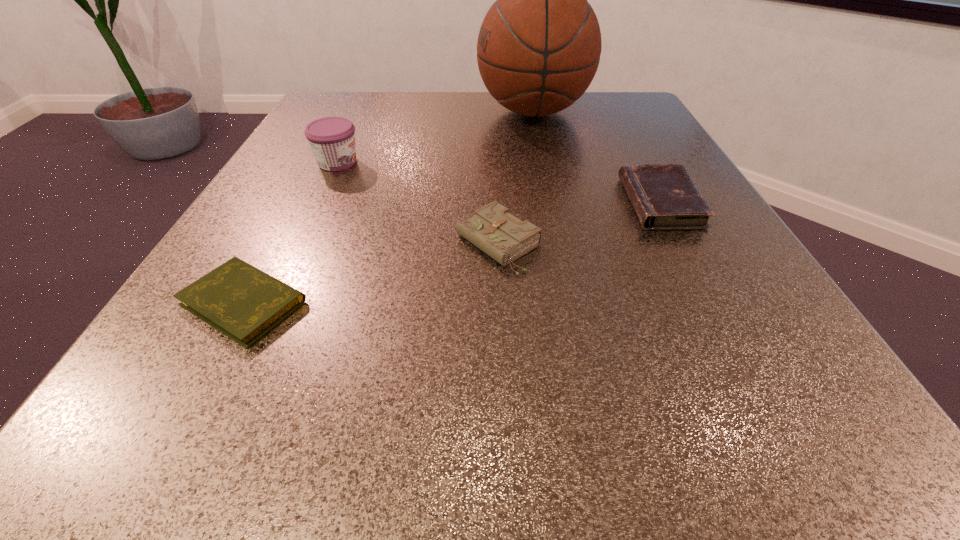
You are a GUI agent. You are given a task and a screenshot of the screen. Output one action in this format:
    pyautogui.click(x=<x>, y=<y>)
    Task: Click on the object at the far right corner
    Image resolution: width=960 pixels, height=540 pixels.
    Given the screenshot: What is the action you would take?
    (x=539, y=45)

In the image, there is a desktop. Where is `vacant space at the far edge`? This screenshot has width=960, height=540. vacant space at the far edge is located at coordinates (571, 117).

At what (x,y) coordinates should I click in order to perform the action: click on vacant region at the near edge. Please return your answer as a coordinate pair (x, y). The image size is (960, 540). Looking at the image, I should click on (356, 382).

You are a GUI agent. You are given a task and a screenshot of the screen. Output one action in this format:
    pyautogui.click(x=<x>, y=<y>)
    Task: Click on the vacant space at the left edge of the desktop
    The width and height of the screenshot is (960, 540).
    Given the screenshot: What is the action you would take?
    (x=340, y=173)

Identify the location of blank area at the right edge. (641, 231).

At what (x,y) coordinates should I click in order to perform the action: click on vacant region at the far left corner of the desktop. Please return your answer as a coordinate pair (x, y). The height and width of the screenshot is (540, 960). Looking at the image, I should click on (372, 101).

At what (x,y) coordinates should I click in order to perform the action: click on vacant space at the near right corner of the desktop. Please return your answer as a coordinate pair (x, y). This screenshot has height=540, width=960. Looking at the image, I should click on (796, 414).

This screenshot has height=540, width=960. In order to click on free spot between the shortest object and the second diary from right to left in this screenshot , I will do `click(371, 273)`.

Where is `free point between the rightmost diary and the jam`? The width and height of the screenshot is (960, 540). free point between the rightmost diary and the jam is located at coordinates (499, 183).

Locate an element on the screen. The width and height of the screenshot is (960, 540). free spot between the rightmost diary and the basketball is located at coordinates (597, 157).